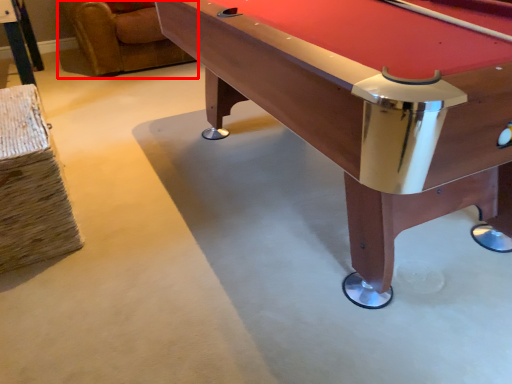
Question: From the image's perspective, where is swivel chair (annotated by the red box) located relative to billiard table?

Choices:
 (A) below
 (B) above

Answer: (B)